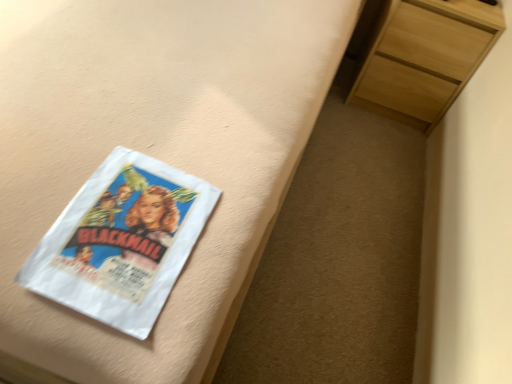
Question: Would you say matte white bed frame at upper left is outside light wood chest of drawers at upper right?

Choices:
 (A) no
 (B) yes

Answer: (B)

Question: Are matte white bed frame at upper left and light wood chest of drawers at upper right far apart?

Choices:
 (A) yes
 (B) no

Answer: (B)

Question: Does matte white bed frame at upper left have a larger size compared to light wood chest of drawers at upper right?

Choices:
 (A) yes
 (B) no

Answer: (A)

Question: From a real-world perspective, does matte white bed frame at upper left stand above light wood chest of drawers at upper right?

Choices:
 (A) no
 (B) yes

Answer: (B)

Question: Is matte white bed frame at upper left in front of light wood chest of drawers at upper right?

Choices:
 (A) no
 (B) yes

Answer: (B)

Question: From a real-world perspective, is matte white bed frame at upper left under light wood chest of drawers at upper right?

Choices:
 (A) no
 (B) yes

Answer: (A)

Question: Does white paper at left have a larger size compared to matte white bed frame at upper left?

Choices:
 (A) yes
 (B) no

Answer: (B)

Question: Is white paper at left positioned in front of matte white bed frame at upper left?

Choices:
 (A) no
 (B) yes

Answer: (A)

Question: Are white paper at left and matte white bed frame at upper left far apart?

Choices:
 (A) no
 (B) yes

Answer: (A)

Question: Is white paper at left outside matte white bed frame at upper left?

Choices:
 (A) no
 (B) yes

Answer: (A)

Question: Does white paper at left have a greater height compared to matte white bed frame at upper left?

Choices:
 (A) yes
 (B) no

Answer: (B)

Question: Can you see white paper at left touching matte white bed frame at upper left?

Choices:
 (A) no
 (B) yes

Answer: (A)

Question: From a real-world perspective, is light wood chest of drawers at upper right over white paper at left?

Choices:
 (A) yes
 (B) no

Answer: (B)